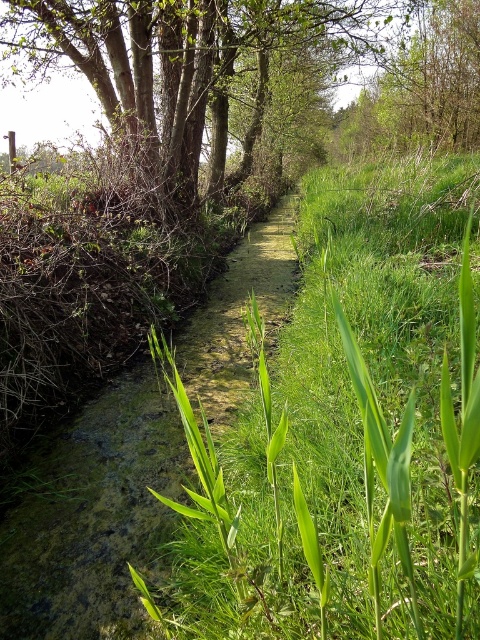
Can you confirm if green leafy grass at center is positioned to the left of green leafy tree at upper center?

Yes, green leafy grass at center is to the left of green leafy tree at upper center.

Can you confirm if green leafy grass at center is taller than green leafy tree at upper center?

No, green leafy grass at center is not taller than green leafy tree at upper center.

This screenshot has width=480, height=640. What do you see at coordinates (358, 426) in the screenshot? I see `green leafy grass at center` at bounding box center [358, 426].

Image resolution: width=480 pixels, height=640 pixels. Identify the location of green leafy grass at center. (358, 426).

Does brown rough tree at upper left come behind green leafy tree at upper center?

That is False.

Is brown rough tree at upper left shorter than green leafy tree at upper center?

No.

Find the location of a particular element. This screenshot has height=640, width=480. brown rough tree at upper left is located at coordinates (182, 52).

What are the coordinates of `brown rough tree at upper left` in the screenshot? It's located at (182, 52).

Is point (350, 170) more distant than point (98, 92)?

Yes, point (350, 170) is farther from viewer.

Which is more to the right, green leafy grass at center or brown rough tree at upper left?

From the viewer's perspective, brown rough tree at upper left appears more on the right side.

Find the location of a particular element. This screenshot has width=480, height=640. green leafy grass at center is located at coordinates click(358, 426).